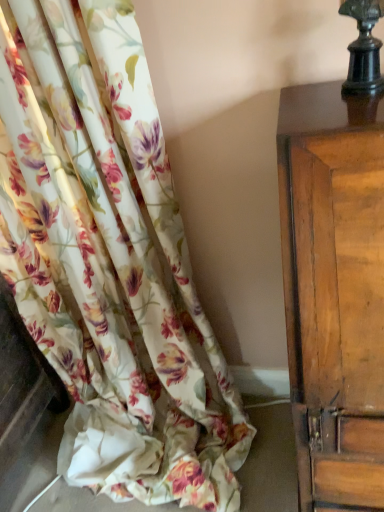
Find the location of `floral fabric curtain at left`. floral fabric curtain at left is located at coordinates (110, 263).

The height and width of the screenshot is (512, 384). Describe the element at coordinates (110, 263) in the screenshot. I see `floral fabric curtain at left` at that location.

What is the approximate width of floral fabric curtain at left?

floral fabric curtain at left is 17.09 inches in width.

Locate an element on the screen. This screenshot has height=512, width=384. floral fabric curtain at left is located at coordinates (110, 263).